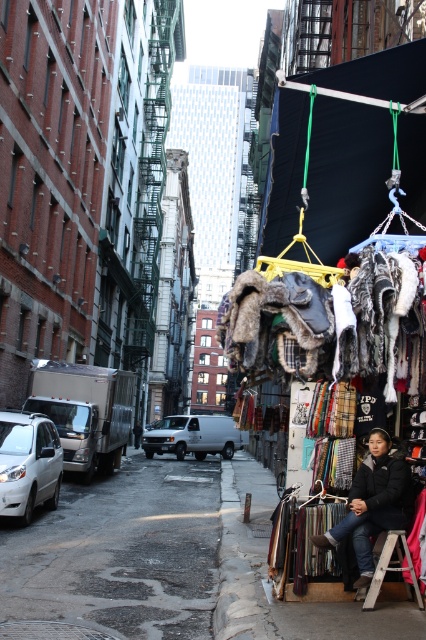
You are a delivery person carrying a heavy box and need to cross from the wet asphalt at lower left to the black fuzzy hat at lower right. The box is 3 meters long. Can you place the box diagonally between them without overlapping?

The distance between the wet asphalt at lower left and black fuzzy hat at lower right is 3.51 meters. Since the box is 3 meters long, it can be placed diagonally between them without overlapping as the distance is sufficient.

You are a delivery person standing at the entrance of the alleyway in the urban street scene. You need to place a package on the smooth wooden board at lower right. Can you reach it without moving closer than your current position?

The smooth wooden board at lower right is 5.19 meters away from viewer, so yes, the delivery person can reach it without moving closer than their current position if their delivery tool has sufficient range. However, if they need to place it manually, they might need to approach closer.